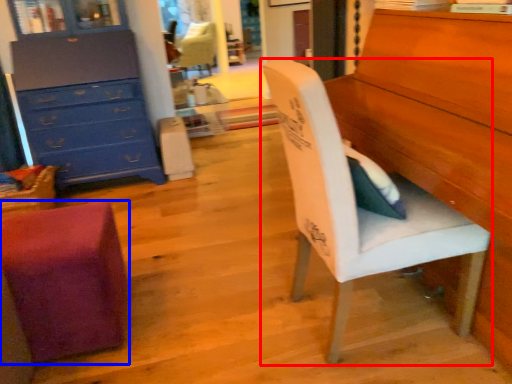
Question: Which object appears closest to the camera in this image, chair (highlighted by a red box) or chair (highlighted by a blue box)?

Choices:
 (A) chair
 (B) chair

Answer: (A)